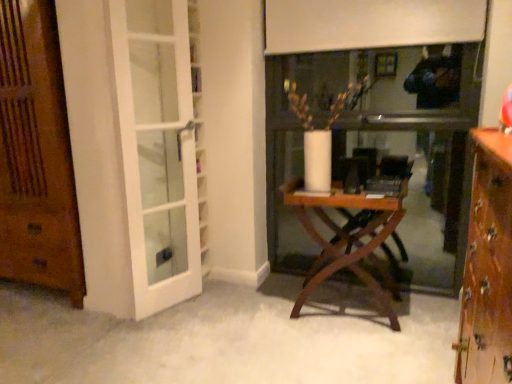
Question: Does white glass door at left have a greater width compared to wooden door at left?

Choices:
 (A) no
 (B) yes

Answer: (A)

Question: From the image's perspective, is white glass door at left located above wooden door at left?

Choices:
 (A) yes
 (B) no

Answer: (B)

Question: Is white glass door at left surrounding wooden door at left?

Choices:
 (A) yes
 (B) no

Answer: (B)

Question: Considering the relative positions of white glass door at left and wooden door at left in the image provided, is white glass door at left to the right of wooden door at left from the viewer's perspective?

Choices:
 (A) yes
 (B) no

Answer: (A)

Question: From the image's perspective, is white glass door at left beneath wooden door at left?

Choices:
 (A) yes
 (B) no

Answer: (A)

Question: In terms of size, does wooden folding table at center appear bigger or smaller than wooden door at left?

Choices:
 (A) big
 (B) small

Answer: (B)

Question: Is point (329, 221) positioned closer to the camera than point (23, 117)?

Choices:
 (A) farther
 (B) closer

Answer: (A)

Question: From a real-world perspective, is wooden folding table at center physically located above or below wooden door at left?

Choices:
 (A) below
 (B) above

Answer: (A)

Question: Based on their positions, is wooden folding table at center located to the left or right of wooden door at left?

Choices:
 (A) left
 (B) right

Answer: (B)

Question: From the image's perspective, is white glass door at left above or below wooden folding table at center?

Choices:
 (A) below
 (B) above

Answer: (B)

Question: Looking at the image, does white glass door at left seem bigger or smaller compared to wooden folding table at center?

Choices:
 (A) big
 (B) small

Answer: (B)

Question: Based on their positions, is white glass door at left located to the left or right of wooden folding table at center?

Choices:
 (A) right
 (B) left

Answer: (B)

Question: Would you say white glass door at left is inside or outside wooden folding table at center?

Choices:
 (A) outside
 (B) inside

Answer: (A)

Question: In terms of height, does wooden door at left look taller or shorter compared to white glass door at left?

Choices:
 (A) tall
 (B) short

Answer: (A)

Question: From a real-world perspective, relative to white glass door at left, is wooden door at left vertically above or below?

Choices:
 (A) below
 (B) above

Answer: (B)